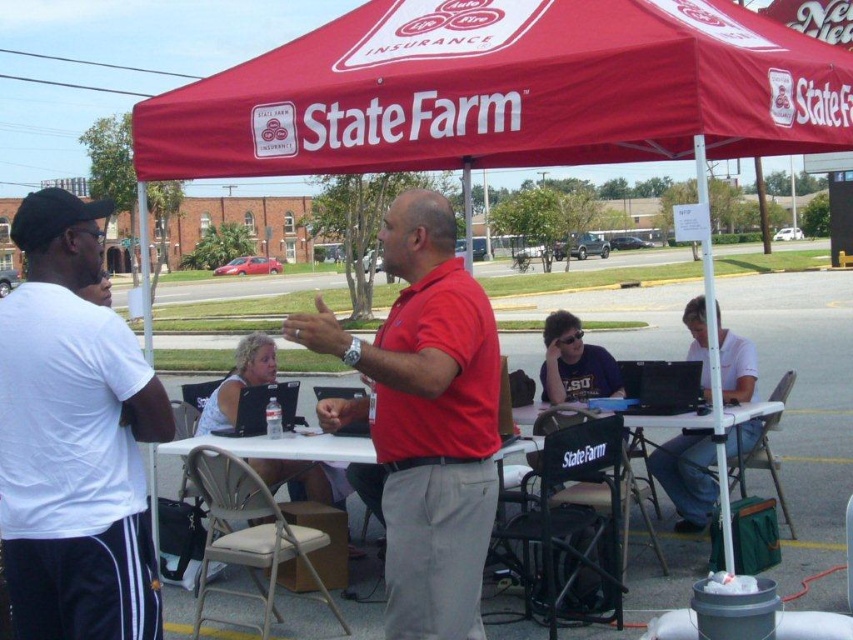
Which is behind, point (160, 417) or point (531, 420)?

The point (531, 420) is more distant.

Can you confirm if white cotton t-shirt at left is smaller than white plastic table at center?

No, white cotton t-shirt at left is not smaller than white plastic table at center.

Which is in front, point (86, 404) or point (717, 472)?

Point (86, 404)

This screenshot has width=853, height=640. I want to click on white cotton t-shirt at left, so (73, 438).

Does red fabric canopy at upper center have a smaller size compared to white cotton t-shirt at left?

No.

Is red fabric canopy at upper center to the right of white cotton t-shirt at left from the viewer's perspective?

Indeed, red fabric canopy at upper center is positioned on the right side of white cotton t-shirt at left.

Identify the location of red fabric canopy at upper center. tap(503, 92).

Can you confirm if white cotton t-shirt at left is shorter than red matte shirt at center?

In fact, white cotton t-shirt at left may be taller than red matte shirt at center.

Where is `white cotton t-shirt at left`? The width and height of the screenshot is (853, 640). white cotton t-shirt at left is located at coordinates (73, 438).